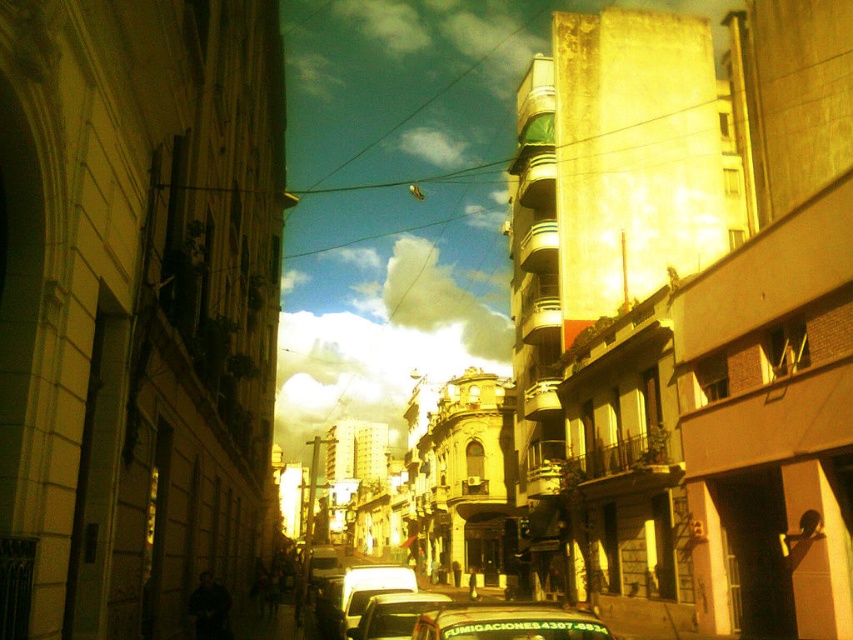
You are a delivery driver who needs to park your vehicle between two other cars. You see a metallic green taxi at center and a metallic silver car at center. Which vehicle should you avoid if you want to choose the narrower space between them?

You should avoid the metallic green taxi at center because it is wider than the metallic silver car at center, so the space between them would be narrower for the taxi.

You are a pedestrian standing at the edge of the street in this urban scene. You need to cross the street to reach the beige building with arches on the left. There is a metallic green taxi at center and a metallic silver car at center. Which vehicle is closer to you?

The metallic green taxi at center is closer to you since it is only 21.62 feet away from the metallic silver car at center, but without knowing the exact distance from you to each vehicle, we cannot determine which is closer. However, based on their positions at the center, they are equidistant from the edge where you are standing.

You are a photographer trying to capture both the shiny silver car at center and the metallic silver car at center in a single frame. Which car should you focus on to ensure both are in the frame without moving your camera position?

The metallic silver car at center is smaller than the shiny silver car at center, so focusing on the shiny silver car at center would allow the smaller metallic silver car at center to fit within the frame as well.